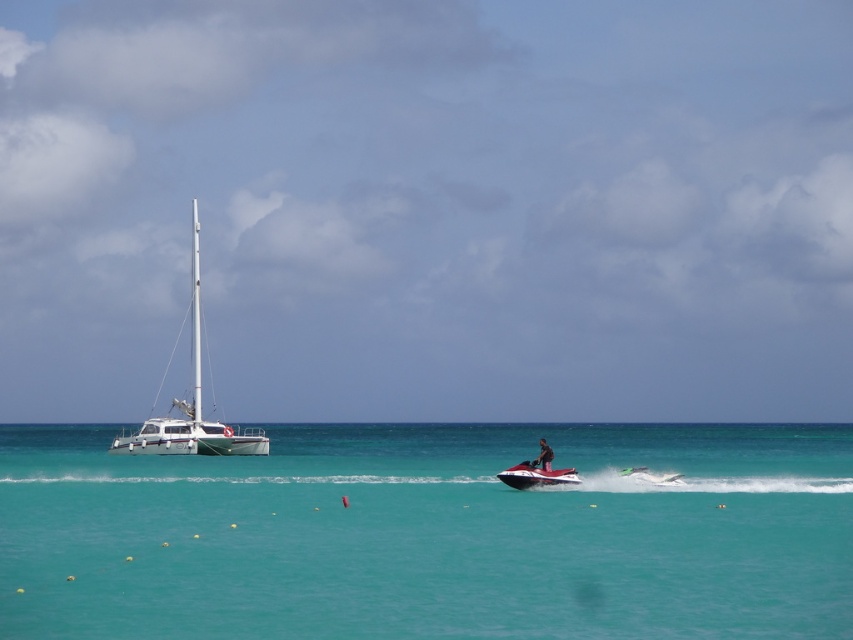
Question: Is turquoise glossy water at center bigger than white glossy sailboat at left?

Choices:
 (A) no
 (B) yes

Answer: (A)

Question: Which point appears closest to the camera in this image?

Choices:
 (A) (538, 461)
 (B) (376, 621)
 (C) (180, 410)
 (D) (529, 483)

Answer: (B)

Question: Is white glossy sailboat at left to the left of shiny black jet ski at center from the viewer's perspective?

Choices:
 (A) no
 (B) yes

Answer: (B)

Question: Estimate the real-world distances between objects in this image. Which object is farther from the white glossy sailboat at left?

Choices:
 (A) dark skin human at center
 (B) shiny black jet ski at center

Answer: (A)

Question: Which of these objects is positioned farthest from the turquoise glossy water at center?

Choices:
 (A) white glossy sailboat at left
 (B) dark skin human at center
 (C) shiny black jet ski at center

Answer: (B)

Question: Is shiny black jet ski at center further to camera compared to dark skin human at center?

Choices:
 (A) no
 (B) yes

Answer: (B)